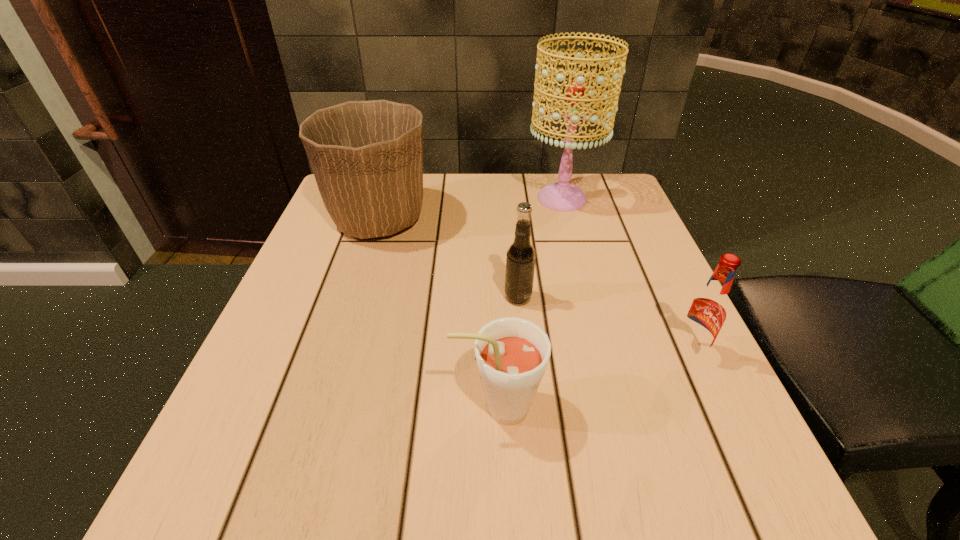
You are a GUI agent. You are given a task and a screenshot of the screen. Output one action in this format:
    pyautogui.click(x=<x>, y=<y>)
    Task: Click on the free region located 0.260m on the label of the farthest root beer
    This screenshot has width=960, height=540.
    Given the screenshot: What is the action you would take?
    pyautogui.click(x=367, y=298)

You are a GUI agent. You are given a task and a screenshot of the screen. Output one action in this format:
    pyautogui.click(x=<x>, y=<y>)
    Task: Click on the free space located 0.100m on the label of the farthest root beer
    
    Given the screenshot: What is the action you would take?
    pyautogui.click(x=451, y=298)

This screenshot has height=540, width=960. I want to click on free spot located 0.060m on the label of the farthest root beer, so click(x=472, y=298).

This screenshot has height=540, width=960. Find the location of `free space located 0.280m on the left of the rightmost root beer`. free space located 0.280m on the left of the rightmost root beer is located at coordinates (505, 352).

The image size is (960, 540). I want to click on vacant space located 0.190m on the drink side of the nearest root beer, so click(326, 407).

Identify the location of free space located on the drink side of the nearest root beer. (379, 407).

This screenshot has height=540, width=960. I want to click on free spot located on the drink side of the nearest root beer, so click(x=293, y=407).

Find the location of a particular element. The width and height of the screenshot is (960, 540). lampshade positioned at the far edge is located at coordinates (561, 196).

At what (x,y) coordinates should I click in order to perform the action: click on flowerpot located at the far edge. Please return your answer as a coordinate pair (x, y). The image size is (960, 540). Looking at the image, I should click on (367, 156).

This screenshot has width=960, height=540. Find the location of `object situated at the left edge`. object situated at the left edge is located at coordinates (367, 156).